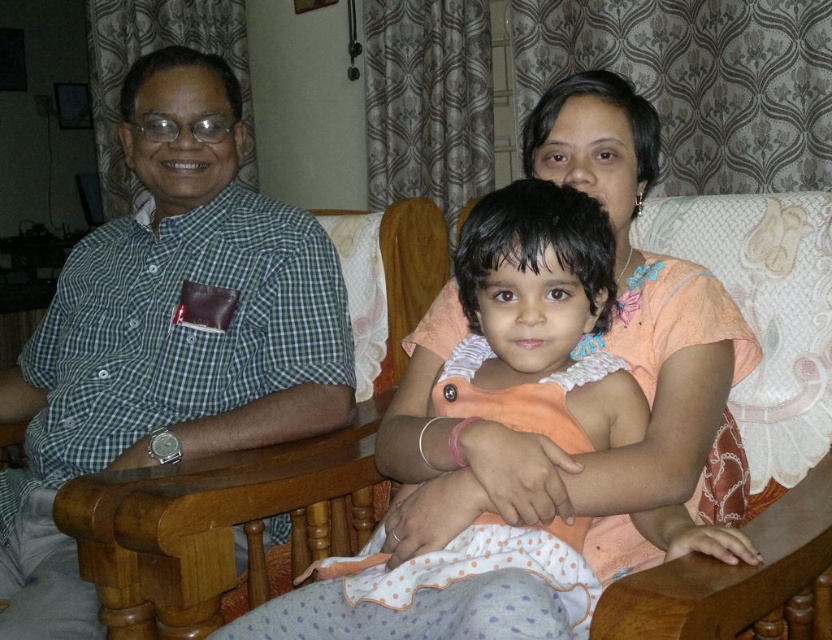
Does green checkered shirt at left appear on the left side of light orange fabric dress at center?

Correct, you'll find green checkered shirt at left to the left of light orange fabric dress at center.

Is green checkered shirt at left shorter than light orange fabric dress at center?

In fact, green checkered shirt at left may be taller than light orange fabric dress at center.

The image size is (832, 640). What do you see at coordinates (167, 333) in the screenshot? I see `green checkered shirt at left` at bounding box center [167, 333].

Where is `green checkered shirt at left`? green checkered shirt at left is located at coordinates (167, 333).